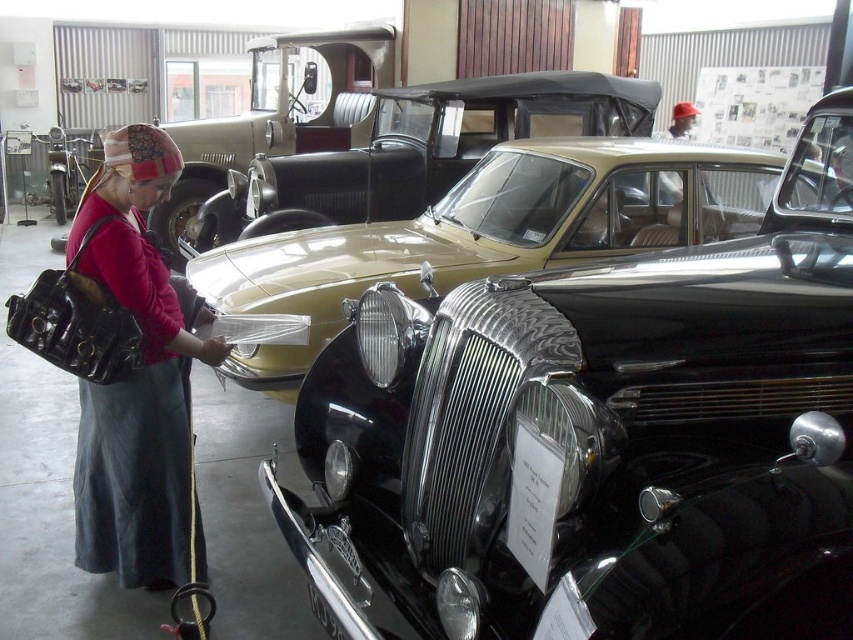
Question: Which point appears farthest from the camera in this image?

Choices:
 (A) (91, 440)
 (B) (300, 378)
 (C) (267, 225)
 (D) (421, 492)

Answer: (C)

Question: From the image, what is the correct spatial relationship of matte black purse at left in relation to beige fabric convertible at center?

Choices:
 (A) above
 (B) below

Answer: (B)

Question: Which is farther from the beige fabric convertible at center?

Choices:
 (A) metallic gold car at center
 (B) matte black purse at left
 (C) black polished metal car at center

Answer: (C)

Question: Is matte black purse at left smaller than beige fabric convertible at center?

Choices:
 (A) no
 (B) yes

Answer: (B)

Question: Which of the following is the closest to the observer?

Choices:
 (A) black polished metal car at center
 (B) beige fabric convertible at center
 (C) metallic gold car at center

Answer: (A)

Question: Can you confirm if black polished metal car at center is positioned to the left of metallic gold car at center?

Choices:
 (A) no
 (B) yes

Answer: (A)